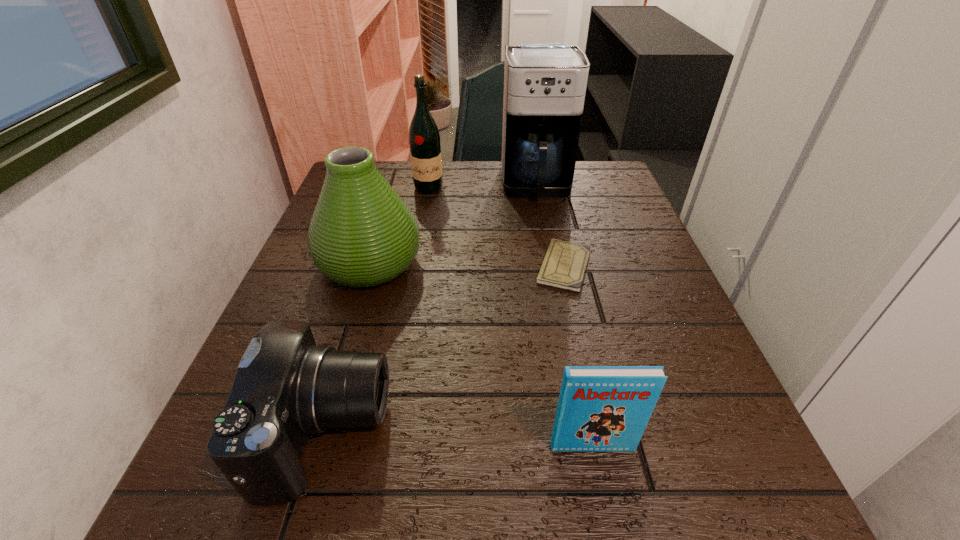
The width and height of the screenshot is (960, 540). I want to click on coffee maker, so click(x=545, y=84).

The height and width of the screenshot is (540, 960). What are the coordinates of `the second tallest object` in the screenshot? It's located at (425, 149).

What are the coordinates of `the third tallest object` in the screenshot? It's located at (362, 234).

Where is `book`? The width and height of the screenshot is (960, 540). book is located at coordinates (601, 408).

Where is `camera`? The height and width of the screenshot is (540, 960). camera is located at coordinates (286, 387).

The width and height of the screenshot is (960, 540). In order to click on the shortest object in this screenshot , I will do `click(564, 264)`.

Where is `vacant region located on the front panel of the coffee maker`? vacant region located on the front panel of the coffee maker is located at coordinates (558, 299).

The width and height of the screenshot is (960, 540). Identify the location of free location located on the front-facing side of the fifth shortest object. (417, 255).

Image resolution: width=960 pixels, height=540 pixels. I want to click on vacant region located on the front of the third tallest object, so pos(306,480).

Locate an element on the screen. The width and height of the screenshot is (960, 540). vacant position located 0.120m on the lens of the fifth tallest object is located at coordinates (464, 433).